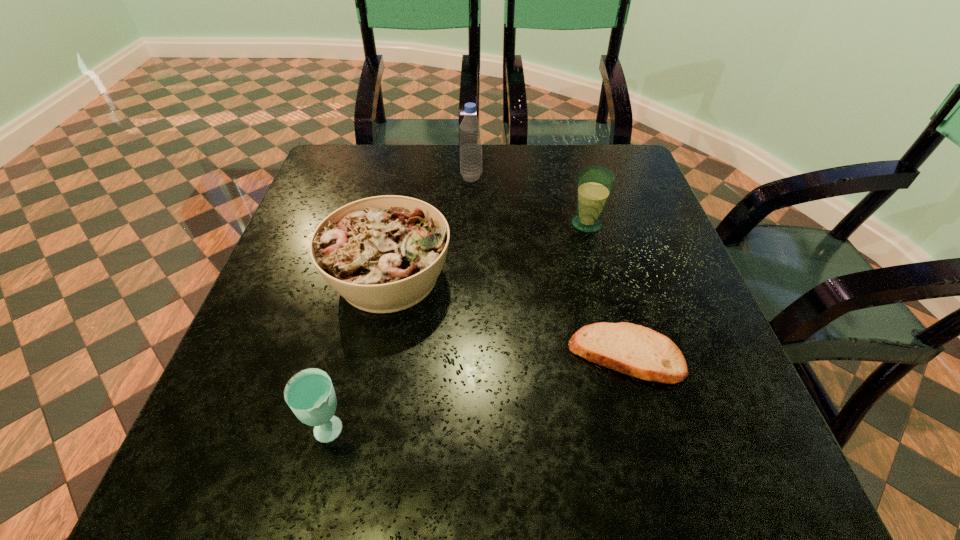
Image resolution: width=960 pixels, height=540 pixels. I want to click on free space at the left edge of the desktop, so pyautogui.click(x=304, y=288).

Where is `vacant space at the right edge of the desktop`? vacant space at the right edge of the desktop is located at coordinates (x=692, y=426).

I want to click on free space at the near left corner, so click(x=264, y=498).

In order to click on free space between the nearest object and the shortest object in this screenshot , I will do `click(478, 394)`.

Locate an element on the screen. This screenshot has height=540, width=960. vacant space in between the farthest object and the farther glass is located at coordinates (529, 200).

Identify the location of free space that is in between the salad and the pita bread. Image resolution: width=960 pixels, height=540 pixels. [508, 316].

The width and height of the screenshot is (960, 540). In order to click on vacant space that is in between the farther glass and the salad in this screenshot , I will do `click(488, 251)`.

Image resolution: width=960 pixels, height=540 pixels. What are the coordinates of `vacant area that lies between the right glass and the nearest object` in the screenshot? It's located at (459, 328).

Locate an element on the screen. This screenshot has width=960, height=540. free space between the salad and the right glass is located at coordinates (488, 251).

Find the location of `free space between the farther glass and the bottle`. free space between the farther glass and the bottle is located at coordinates tap(529, 200).